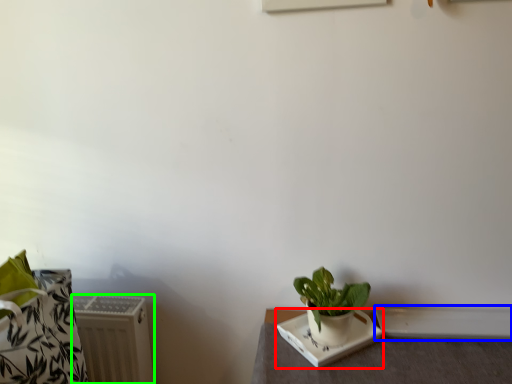
Question: Which object is the farthest from plate (highlighted by a red box)? Choose among these: window sill (highlighted by a blue box) or radiator (highlighted by a green box).

Choices:
 (A) window sill
 (B) radiator

Answer: (B)